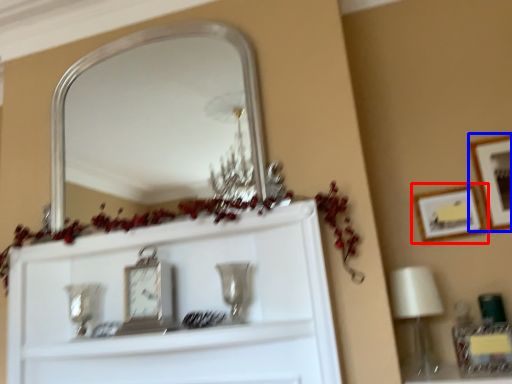
Question: Among these objects, which one is nearest to the camera, picture frame (highlighted by a red box) or picture frame (highlighted by a blue box)?

Choices:
 (A) picture frame
 (B) picture frame

Answer: (B)